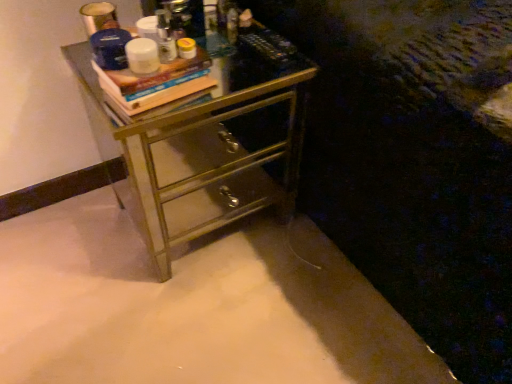
Question: Choose the correct answer: Is metallic gold chest of drawers at center inside wooden book at upper center or outside it?

Choices:
 (A) inside
 (B) outside

Answer: (B)

Question: Is metallic gold chest of drawers at center in front of or behind wooden book at upper center in the image?

Choices:
 (A) front
 (B) behind

Answer: (B)

Question: Does point (202, 153) appear closer or farther from the camera than point (190, 71)?

Choices:
 (A) farther
 (B) closer

Answer: (A)

Question: In the image, is wooden book at upper center on the left side or the right side of metallic gold chest of drawers at center?

Choices:
 (A) left
 (B) right

Answer: (A)

Question: In the image, is wooden book at upper center positioned in front of or behind metallic gold chest of drawers at center?

Choices:
 (A) front
 (B) behind

Answer: (A)

Question: Choose the correct answer: Is wooden book at upper center inside metallic gold chest of drawers at center or outside it?

Choices:
 (A) outside
 (B) inside

Answer: (A)

Question: In terms of height, does wooden book at upper center look taller or shorter compared to metallic gold chest of drawers at center?

Choices:
 (A) tall
 (B) short

Answer: (B)